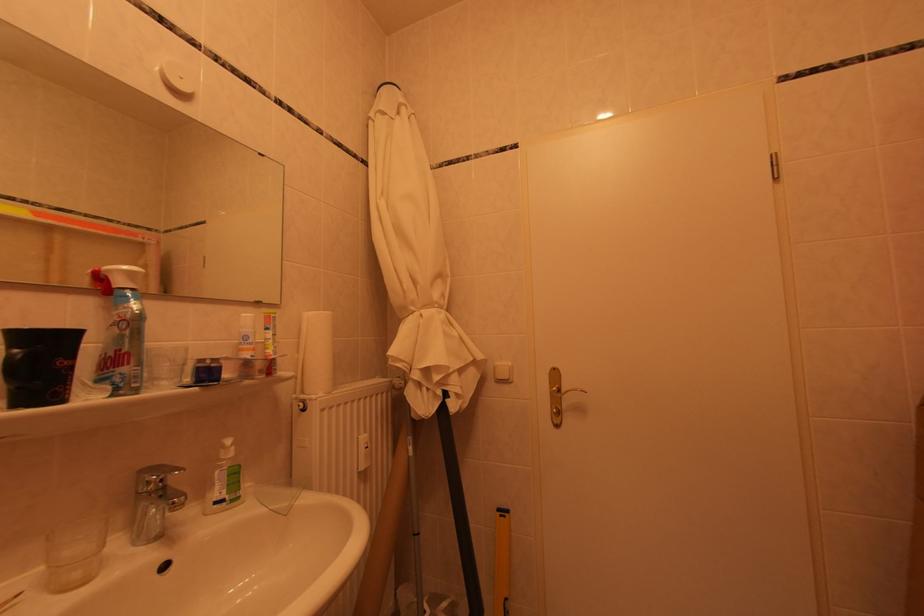
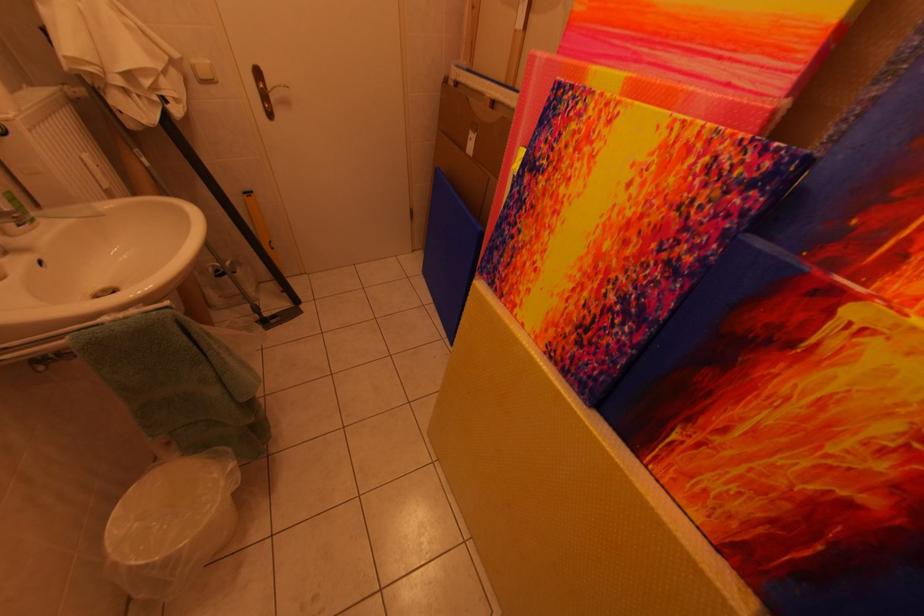
The point at [506,367] is marked in the first image. Where is the corresponding point in the second image?

(203, 65)